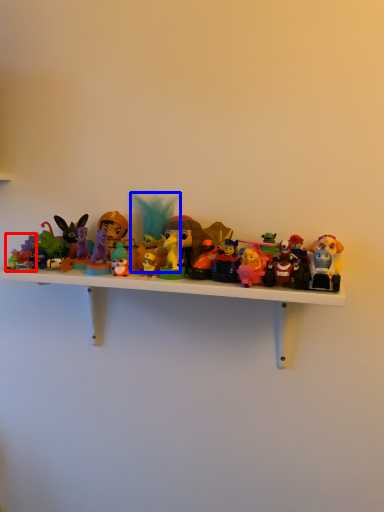
Question: Which point is further to the camera, toy (highlighted by a red box) or toy (highlighted by a blue box)?

Choices:
 (A) toy
 (B) toy

Answer: (B)